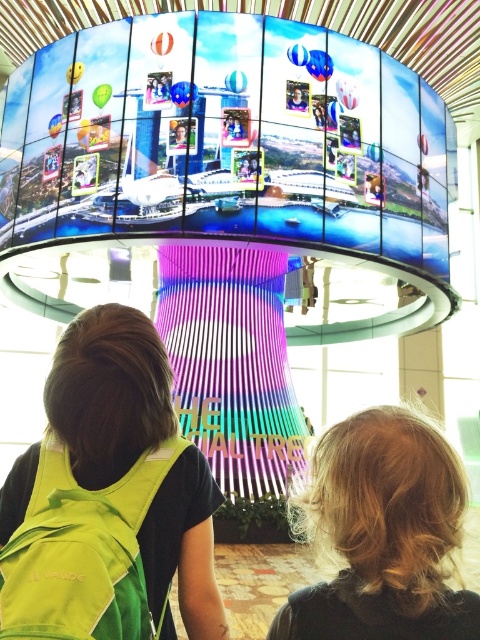
Question: Is blonde hair at upper right positioned before green fabric safety vest at lower left?

Choices:
 (A) no
 (B) yes

Answer: (B)

Question: Among these objects, which one is nearest to the camera?

Choices:
 (A) green fabric safety vest at lower left
 (B) blonde hair at upper right

Answer: (B)

Question: Which point is farther from the camera taking this photo?

Choices:
 (A) (107, 589)
 (B) (466, 593)

Answer: (A)

Question: Among these objects, which one is farthest from the camera?

Choices:
 (A) green fabric safety vest at lower left
 (B) blonde hair at upper right

Answer: (A)

Question: Does blonde hair at upper right have a smaller size compared to green fabric safety vest at lower left?

Choices:
 (A) no
 (B) yes

Answer: (B)

Question: Is blonde hair at upper right positioned behind green fabric safety vest at lower left?

Choices:
 (A) yes
 (B) no

Answer: (B)